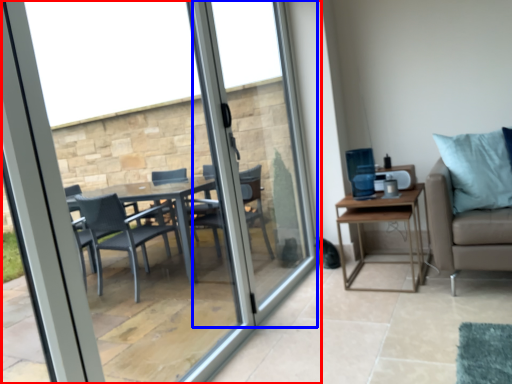
Question: Which of the following is the farthest to the observer, window (highlighted by a red box) or screen door (highlighted by a blue box)?

Choices:
 (A) window
 (B) screen door

Answer: (B)